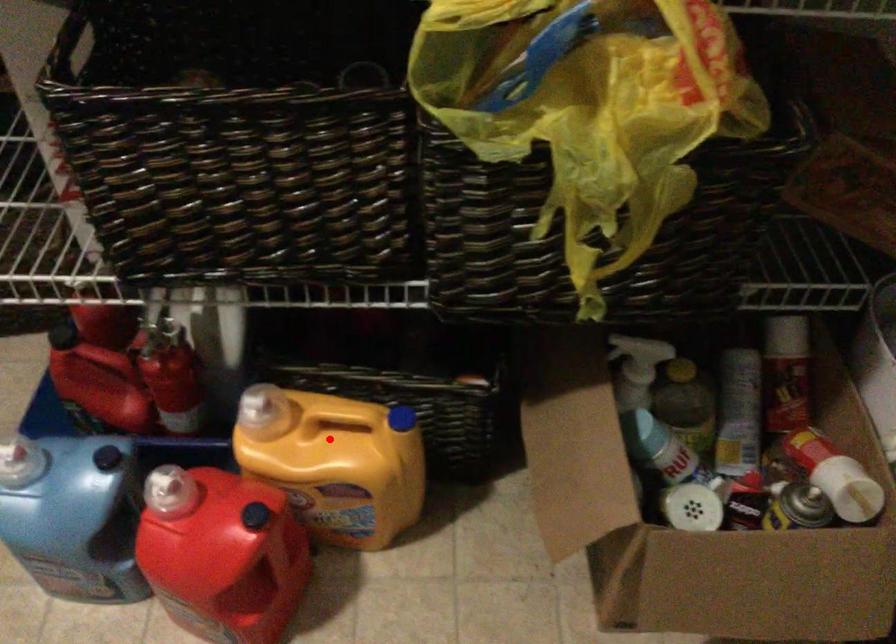
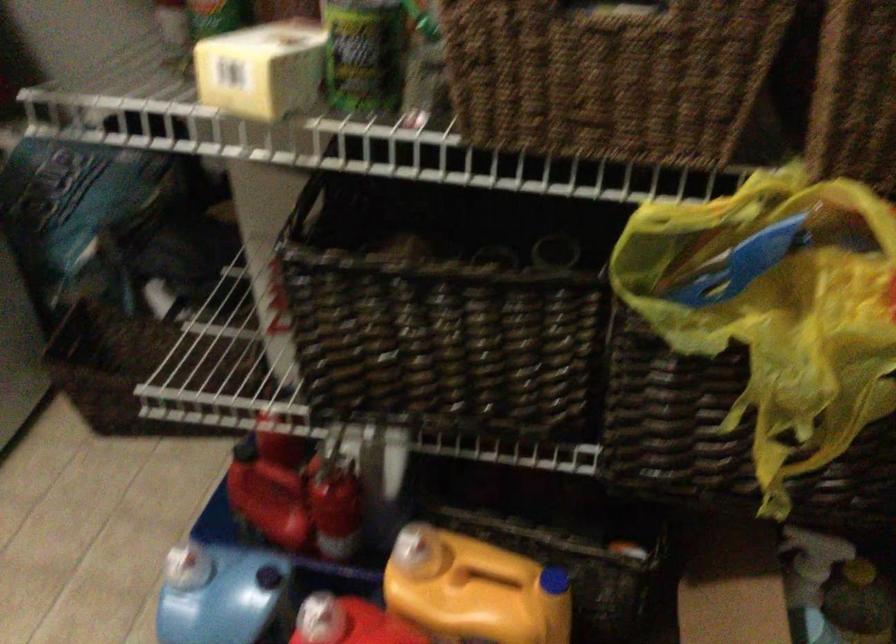
Where in the second image is the point corresponding to the highlighted location from the first image?

(474, 590)